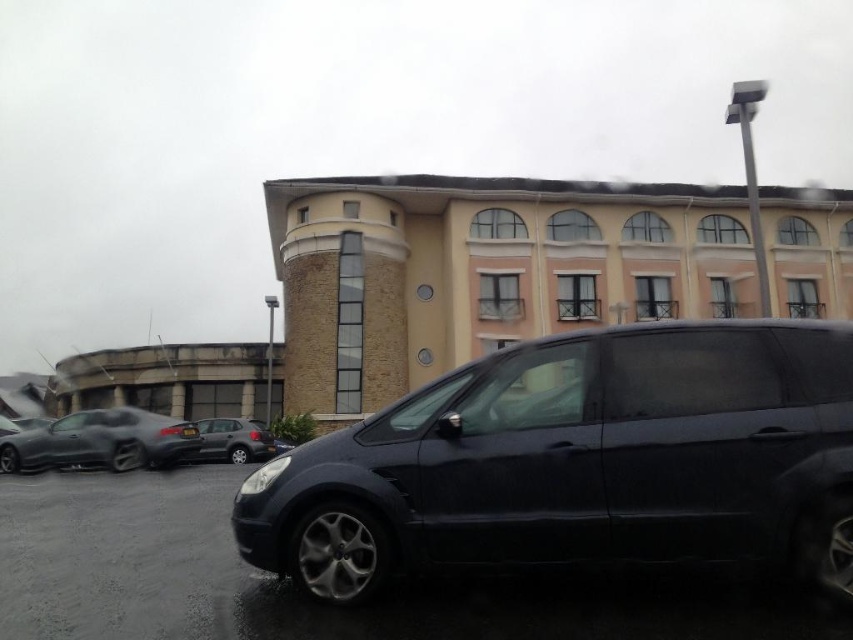
You are a delivery person trying to park your van between the glossy dark blue car at lower center and the shiny black car at left. Your van is 5 meters long. Can you fit your van in the space between them?

The glossy dark blue car at lower center is larger than the shiny black car at left, but the description does not provide the exact distance between them. Without knowing the space between the two cars, it is impossible to determine if the van can fit.

You need to park a new car that is 1.8 meters wide in this parking lot. Given the space between the glossy dark blue car at lower center and the satin silver hatchback at center, can the new car fit?

The glossy dark blue car at lower center is wider than the satin silver hatchback at center. However, the exact width difference isn not provided, so it is uncertain if the 1.8 meter wide new car can fit between them.

You are a delivery driver who needs to back out of the parking spot where you see the glossy dark blue car at lower center and the satin silver hatchback at center. Which car will you see first as you begin reversing?

As you begin reversing, you will first see the satin silver hatchback at center because the glossy dark blue car at lower center is in front of it, blocking the view initially.